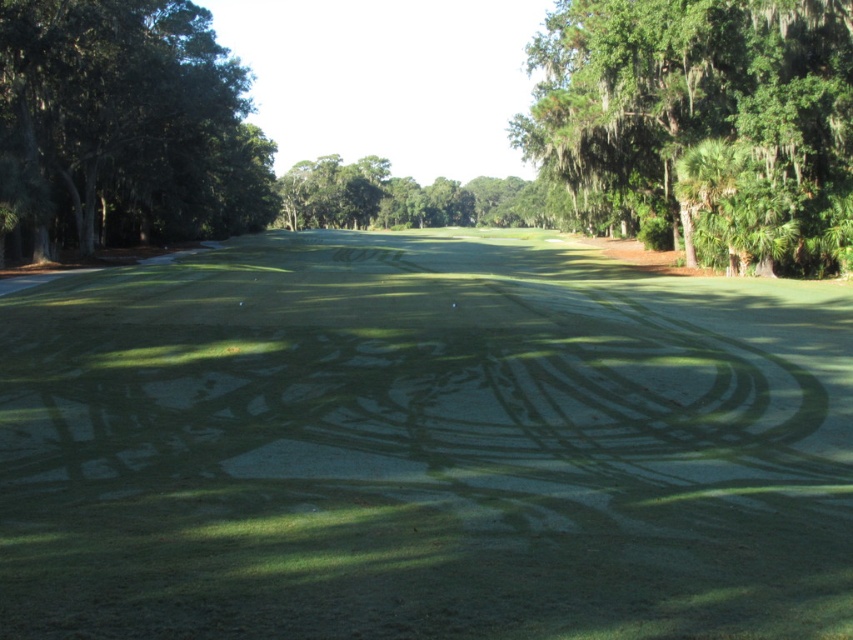
Question: Can you confirm if green leafy tree at upper right is bigger than green leafy tree at left?

Choices:
 (A) no
 (B) yes

Answer: (B)

Question: Does green smooth turf at center have a greater width compared to green leafy tree at upper right?

Choices:
 (A) yes
 (B) no

Answer: (B)

Question: Among these objects, which one is nearest to the camera?

Choices:
 (A) green leafy tree at upper right
 (B) green leafy tree at left

Answer: (B)

Question: Which point is closer to the camera?

Choices:
 (A) (61, 406)
 (B) (22, 157)

Answer: (A)

Question: Can you confirm if green smooth turf at center is smaller than green leafy tree at left?

Choices:
 (A) no
 (B) yes

Answer: (B)

Question: Which object is the closest to the green smooth turf at center?

Choices:
 (A) green leafy tree at upper right
 (B) green leafy tree at left

Answer: (A)